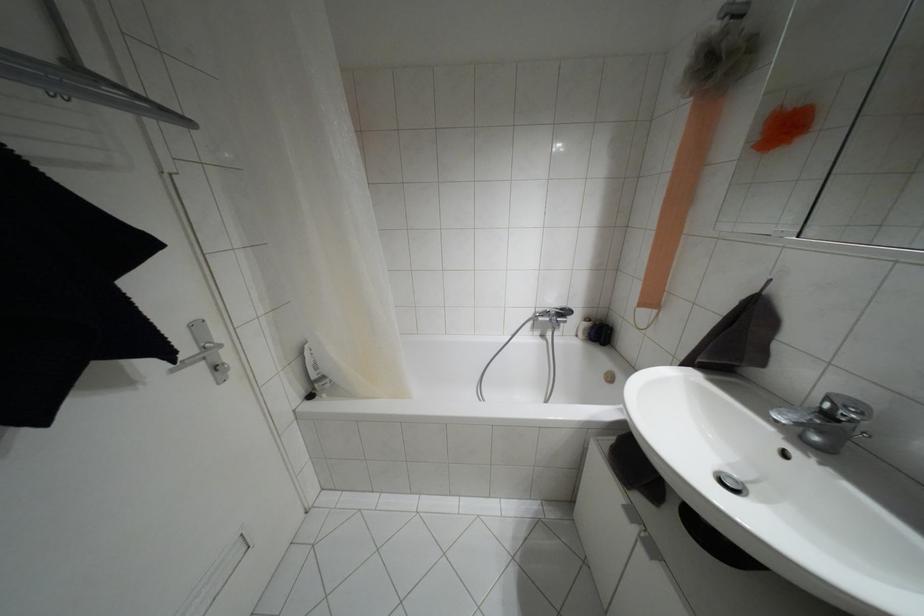
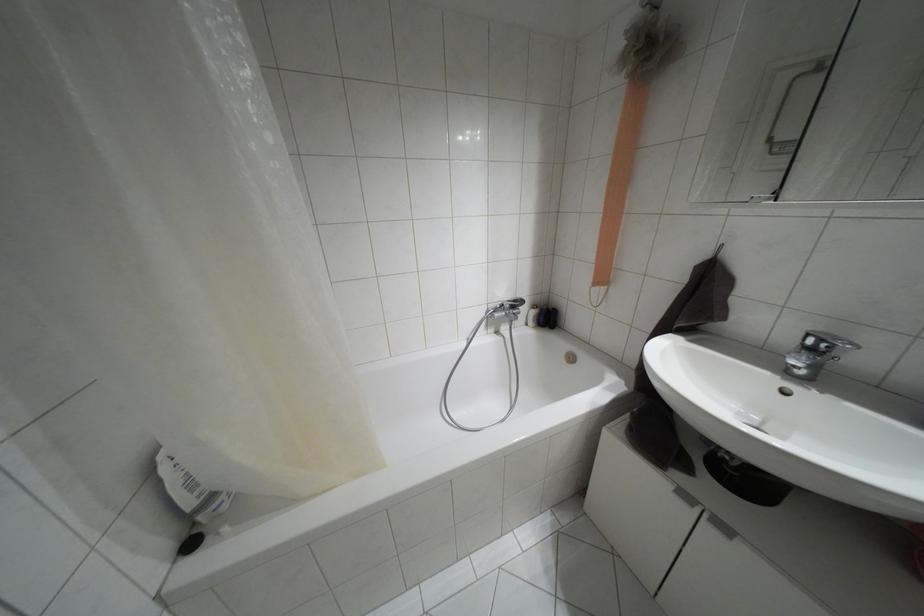
The images are taken continuously from a first-person perspective. In which direction are you moving?

The cameraman walked toward left, forward.